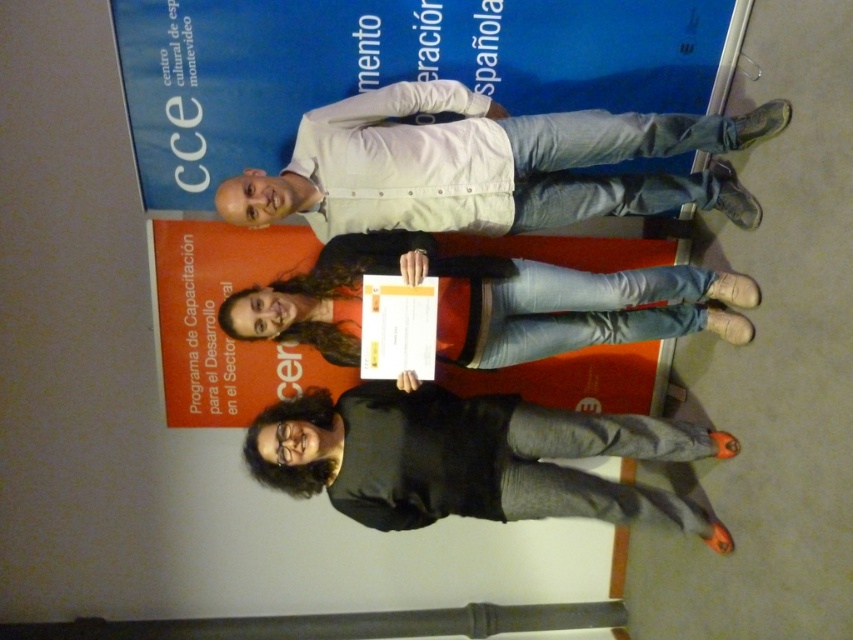
You are attending a formal event and need to locate the person in the center who is holding a certificate. Using the coordinate system where the bottom left corner is the origin, can you determine if the black matte shirt at center is positioned to the right or left of the point 0.6, 0.5?

The black matte shirt at center is positioned to the right of the point (x=426, y=384) because its coordinates are (x=469, y=458), which is higher than 0.6 in the x and y axes.

You are a photographer at the event and need to ensure that both the blue paper at upper center and the black matte shirt at center are clearly visible in the photo. Based on their positions, which object is closer to the camera?

The blue paper at upper center is in front of the black matte shirt at center, so it is closer to the camera.

You are a photographer at the event and need to ensure the blue paper at upper center and denim jeans at center are both visible in the photo. Given their sizes, which object should you focus on to include both in the frame without cropping?

The blue paper at upper center is bigger than denim jeans at center, so you should focus on the larger blue paper at upper center to ensure both objects are visible without cropping.